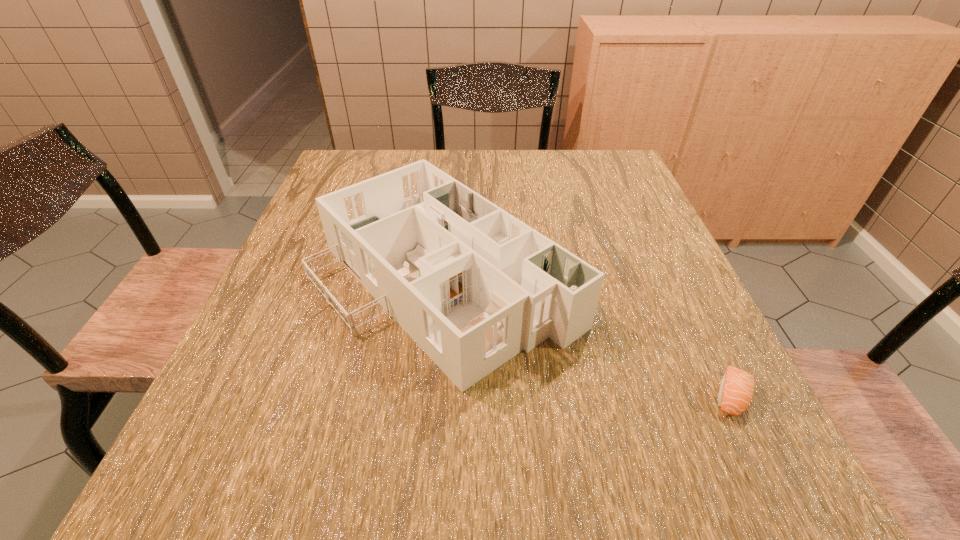
Find the location of a particular element. The width and height of the screenshot is (960, 540). the left object is located at coordinates (472, 285).

You are a GUI agent. You are given a task and a screenshot of the screen. Output one action in this format:
    pyautogui.click(x=<x>, y=<y>)
    Task: Click on the dollhouse
    The image size is (960, 540).
    Given the screenshot: What is the action you would take?
    pyautogui.click(x=472, y=285)

The image size is (960, 540). I want to click on the right object, so click(736, 389).

Identify the location of the shorter object. The image size is (960, 540). (736, 389).

At what (x,y) coordinates should I click in order to perform the action: click on vacant region located 0.240m on the back of the right object. Please return your answer as a coordinate pair (x, y). The height and width of the screenshot is (540, 960). Looking at the image, I should click on (673, 278).

I want to click on object that is at the left edge, so click(x=472, y=285).

Where is `object present at the right edge`? object present at the right edge is located at coordinates (736, 389).

This screenshot has width=960, height=540. In the image, there is a desktop. In order to click on free space at the far edge in this screenshot , I will do point(557,184).

Locate an element on the screen. This screenshot has height=540, width=960. vacant space at the near edge of the desktop is located at coordinates (548, 465).

Locate an element on the screen. The width and height of the screenshot is (960, 540). vacant space at the left edge is located at coordinates (299, 253).